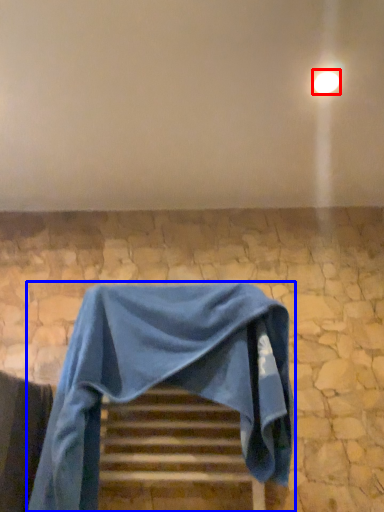
Question: Which object is further to the camera taking this photo, light (highlighted by a red box) or furniture (highlighted by a blue box)?

Choices:
 (A) light
 (B) furniture

Answer: (A)